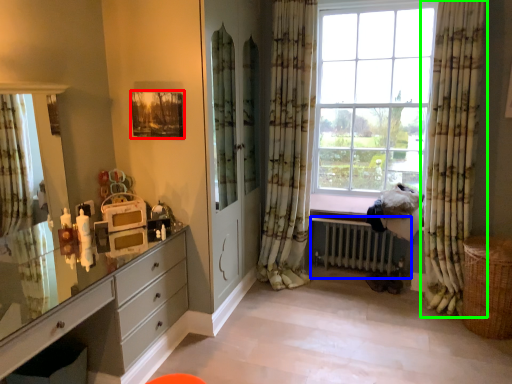
Question: Based on their relative distances, which object is farther from picture frame (highlighted by a red box)? Choose from radiator (highlighted by a blue box) and curtain (highlighted by a green box).

Choices:
 (A) radiator
 (B) curtain

Answer: (B)